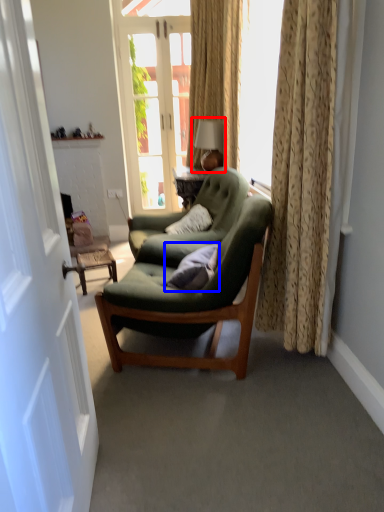
Question: Among these objects, which one is farthest to the camera, table lamp (highlighted by a red box) or pillow (highlighted by a blue box)?

Choices:
 (A) table lamp
 (B) pillow

Answer: (A)